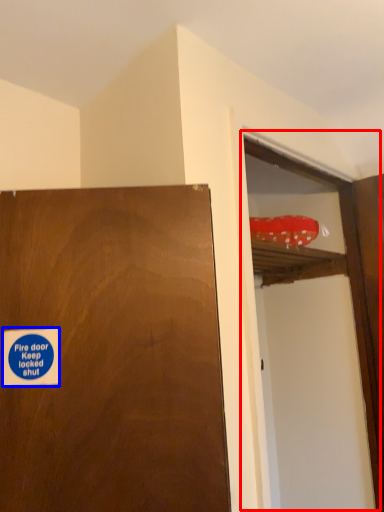
Question: Which point is closer to the camera, screen door (highlighted by a red box) or sticker (highlighted by a blue box)?

Choices:
 (A) screen door
 (B) sticker

Answer: (B)